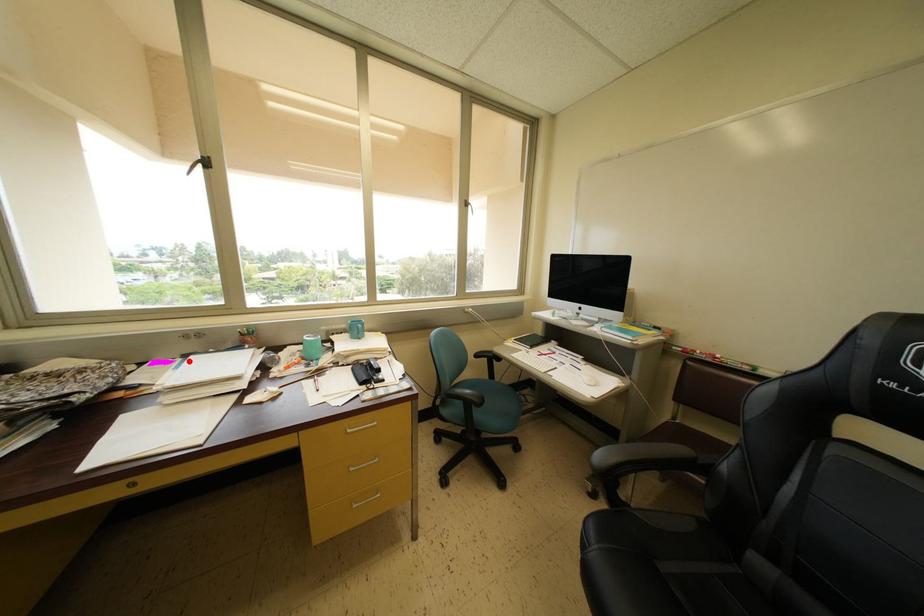
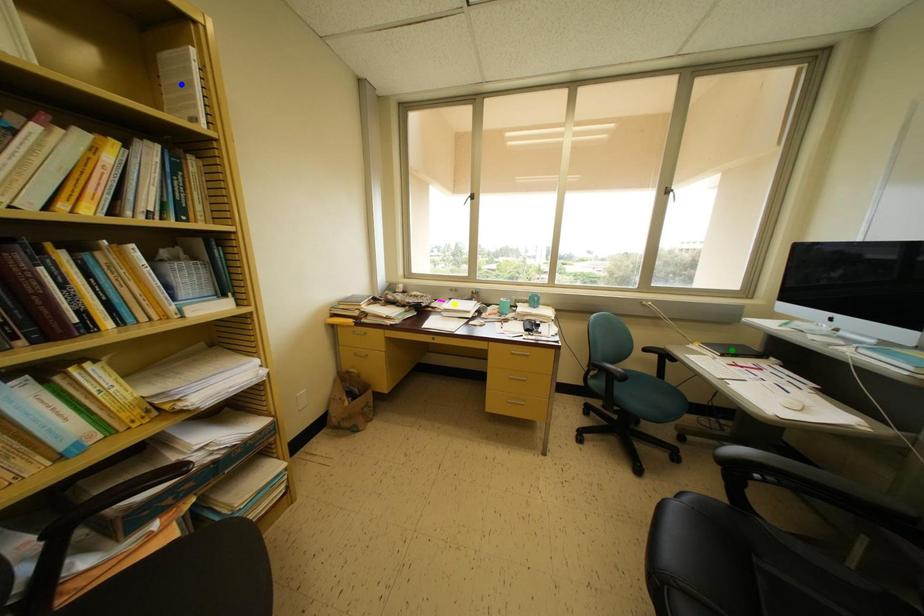
Question: I am providing you with two images of the same scene from different viewpoints. A red point is marked on the first image. You are given multiple points on the second image. Which point in image 2 is actually the same real-world point as the red point in image 1?

Choices:
 (A) green point
 (B) yellow point
 (C) blue point

Answer: (B)